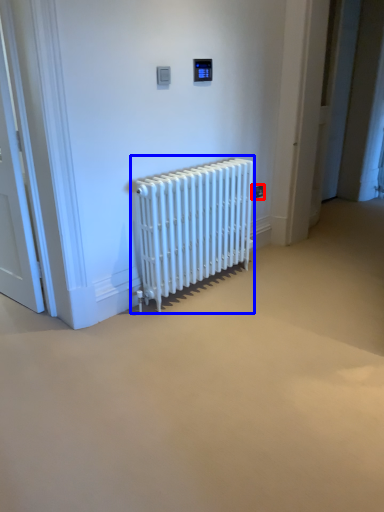
Question: Which object is further to the camera taking this photo, electric outlet (highlighted by a red box) or radiator (highlighted by a blue box)?

Choices:
 (A) electric outlet
 (B) radiator

Answer: (A)